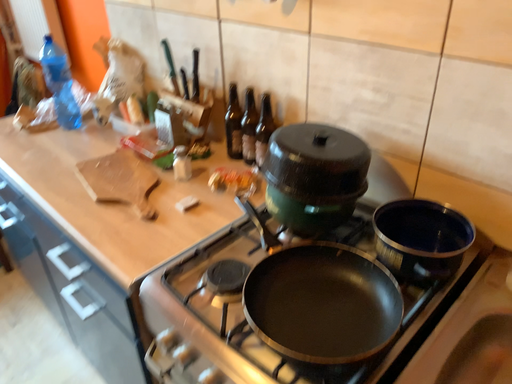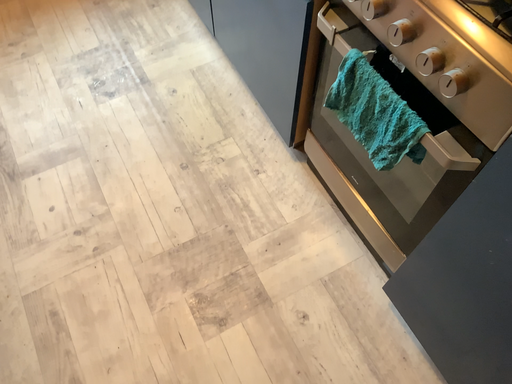
Question: How did the camera likely rotate when shooting the video?

Choices:
 (A) rotated upward
 (B) rotated downward

Answer: (B)